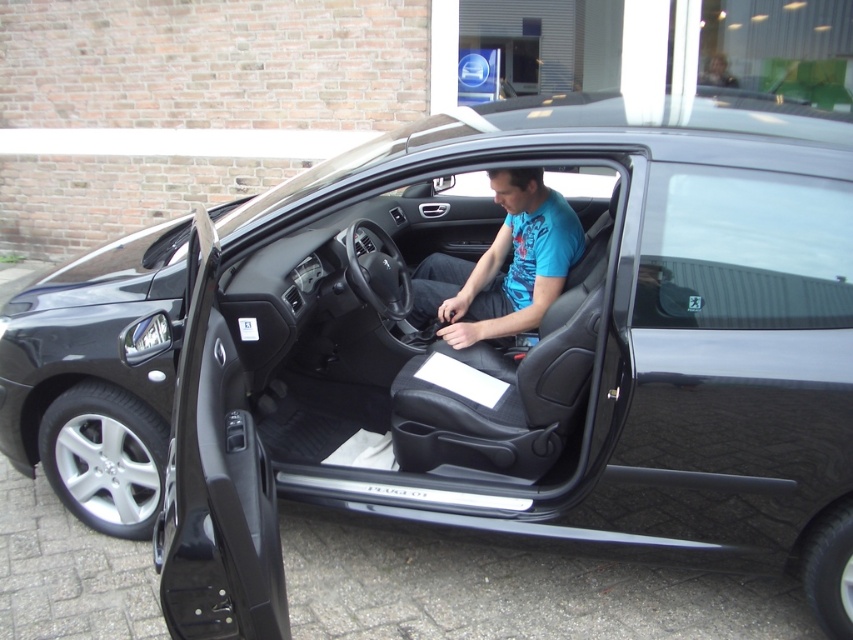
Is black matte door at center to the right of blue matte shirt at center from the viewer's perspective?

Correct, you'll find black matte door at center to the right of blue matte shirt at center.

Does black matte door at center have a greater height compared to blue matte shirt at center?

Indeed, black matte door at center has a greater height compared to blue matte shirt at center.

Find the location of a particular element. black matte door at center is located at coordinates (488, 348).

Where is `black matte door at center`? Image resolution: width=853 pixels, height=640 pixels. black matte door at center is located at coordinates (488, 348).